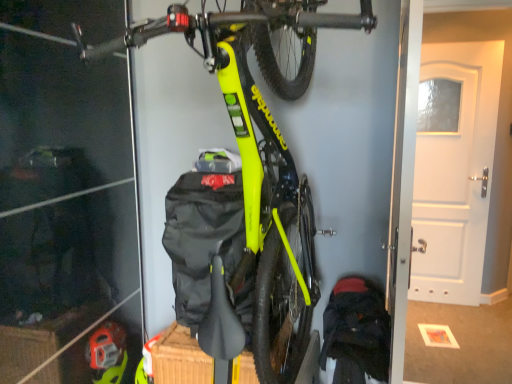
Locate an element on the screen. This screenshot has height=384, width=512. neon yellow matte bicycle at center is located at coordinates [x=259, y=163].

Is dark blue fabric backpack at lower right in contact with white matte door at upper right?

There is a gap between dark blue fabric backpack at lower right and white matte door at upper right.

Find the location of `door behind the dark blue fabric backpack at lower right`. door behind the dark blue fabric backpack at lower right is located at coordinates (457, 177).

Can you confirm if dark blue fabric backpack at lower right is bigger than white matte door at upper right?

No, dark blue fabric backpack at lower right is not bigger than white matte door at upper right.

From the image's perspective, which is below, dark blue fabric backpack at lower right or white matte door at upper right?

dark blue fabric backpack at lower right appears lower in the image.

Can you see dark blue fabric backpack at lower right touching neon yellow matte bicycle at center?

No, dark blue fabric backpack at lower right is not in contact with neon yellow matte bicycle at center.

In terms of width, does dark blue fabric backpack at lower right look wider or thinner when compared to neon yellow matte bicycle at center?

Clearly, dark blue fabric backpack at lower right has less width compared to neon yellow matte bicycle at center.

Is dark blue fabric backpack at lower right inside the boundaries of neon yellow matte bicycle at center, or outside?

dark blue fabric backpack at lower right exists entirely within neon yellow matte bicycle at center.

How different are the orientations of dark blue fabric backpack at lower right and neon yellow matte bicycle at center in degrees?

Result: They differ by 3.09 degrees in their facing directions.

In the scene shown: Which is correct: white matte door at upper right is inside neon yellow matte bicycle at center, or outside of it?

white matte door at upper right is not inside neon yellow matte bicycle at center, it's outside.

Is white matte door at upper right aimed at neon yellow matte bicycle at center?

No.

From a real-world perspective, is white matte door at upper right physically located above or below neon yellow matte bicycle at center?

Clearly, from a real-world perspective, white matte door at upper right is below neon yellow matte bicycle at center.

Looking at this image, is white matte door at upper right wider than neon yellow matte bicycle at center?

No.

Is neon yellow matte bicycle at center taller or shorter than dark blue fabric backpack at lower right?

Clearly, neon yellow matte bicycle at center is taller compared to dark blue fabric backpack at lower right.

How different are the orientations of neon yellow matte bicycle at center and dark blue fabric backpack at lower right in degrees?

3.09 degrees.

Is the position of neon yellow matte bicycle at center more distant than that of dark blue fabric backpack at lower right?

No, it is not.

Are neon yellow matte bicycle at center and white matte door at upper right making contact?

neon yellow matte bicycle at center and white matte door at upper right are clearly separated.

Between neon yellow matte bicycle at center and white matte door at upper right, which one has smaller width?

Thinner between the two is white matte door at upper right.

Which is further, (234, 127) or (466, 112)?

The point (466, 112) is behind.

Based on the photo, would you say neon yellow matte bicycle at center is outside white matte door at upper right?

Yes, neon yellow matte bicycle at center is not within white matte door at upper right.

Is white matte door at upper right situated inside dark blue fabric backpack at lower right or outside?

white matte door at upper right is spatially situated outside dark blue fabric backpack at lower right.

Does white matte door at upper right appear on the left side of dark blue fabric backpack at lower right?

No.

The image size is (512, 384). Identify the location of door behind the dark blue fabric backpack at lower right. (457, 177).

Where is `door on the right of dark blue fabric backpack at lower right`? The height and width of the screenshot is (384, 512). door on the right of dark blue fabric backpack at lower right is located at coordinates (457, 177).

Where is `bicycle above the dark blue fabric backpack at lower right (from the image's perspective)`? The height and width of the screenshot is (384, 512). bicycle above the dark blue fabric backpack at lower right (from the image's perspective) is located at coordinates (259, 163).

Estimate the real-world distances between objects in this image. Which object is closer to neon yellow matte bicycle at center, white matte door at upper right or dark blue fabric backpack at lower right?

dark blue fabric backpack at lower right is closer to neon yellow matte bicycle at center.

Estimate the real-world distances between objects in this image. Which object is further from dark blue fabric backpack at lower right, white matte door at upper right or neon yellow matte bicycle at center?

white matte door at upper right.

Based on their spatial positions, is dark blue fabric backpack at lower right or white matte door at upper right further from neon yellow matte bicycle at center?

The object further to neon yellow matte bicycle at center is white matte door at upper right.

Consider the image. Looking at the image, which one is located further to dark blue fabric backpack at lower right, neon yellow matte bicycle at center or white matte door at upper right?

white matte door at upper right.

Which object lies nearer to the anchor point white matte door at upper right, neon yellow matte bicycle at center or dark blue fabric backpack at lower right?

dark blue fabric backpack at lower right is closer to white matte door at upper right.

Based on the photo, considering their positions, is dark blue fabric backpack at lower right positioned closer to white matte door at upper right than neon yellow matte bicycle at center?

Among the two, dark blue fabric backpack at lower right is located nearer to white matte door at upper right.

Locate an element on the screen. The width and height of the screenshot is (512, 384). backpack positioned between neon yellow matte bicycle at center and white matte door at upper right from near to far is located at coordinates (356, 331).